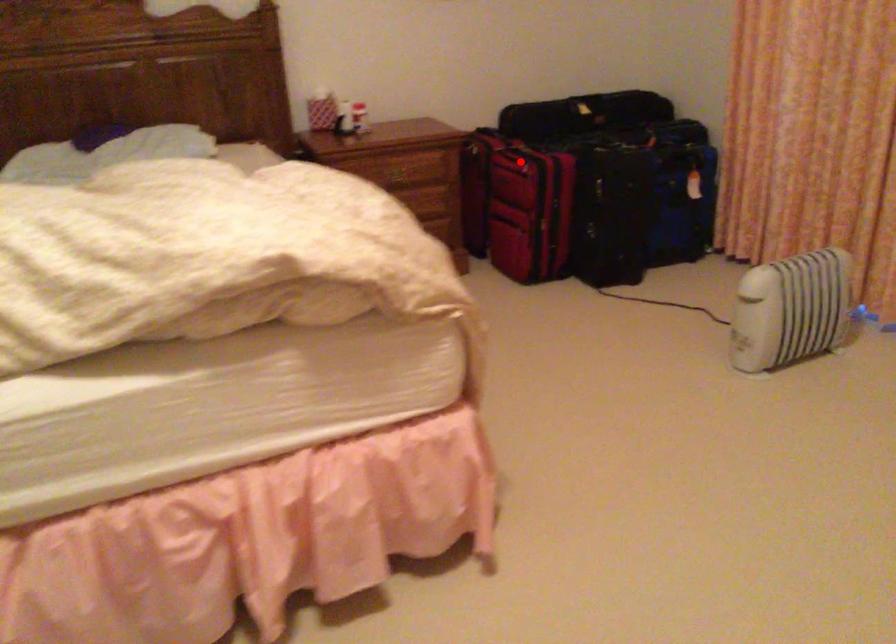
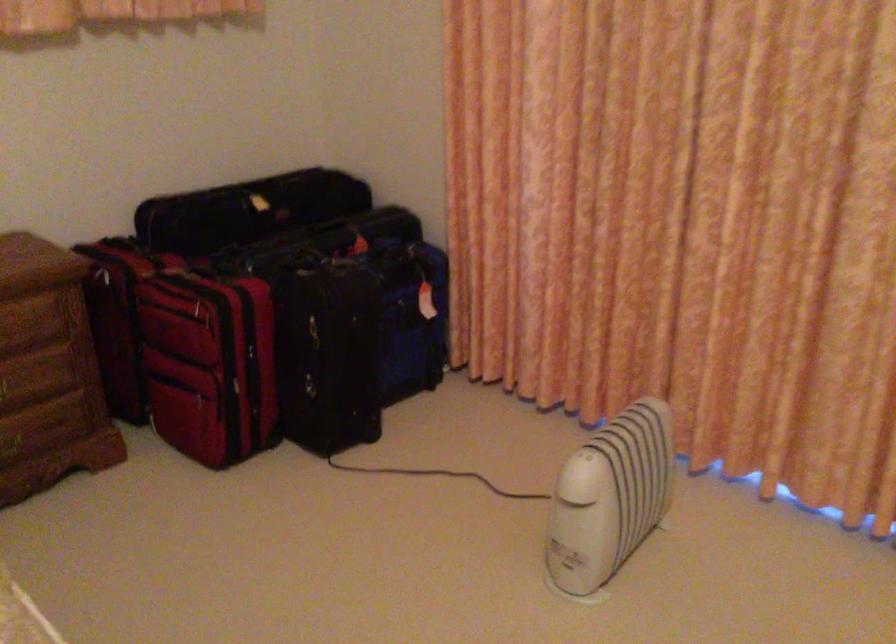
Question: I am providing you with two images of the same scene from different viewpoints. A red point is shown in image1. For the corresponding object point in image2, is it positioned nearer or farther from the camera?

Choices:
 (A) Nearer
 (B) Farther

Answer: (A)